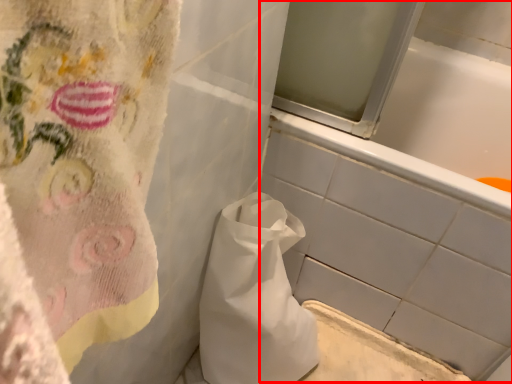
Question: From the image's perspective, what is the correct spatial positioning of bath (annotated by the red box) in reference to paper bag?

Choices:
 (A) above
 (B) below

Answer: (A)